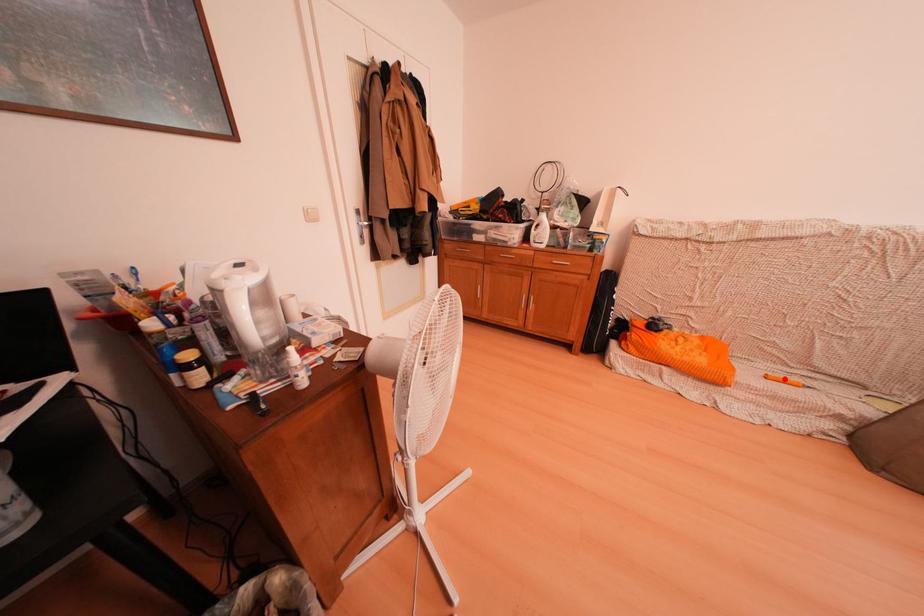
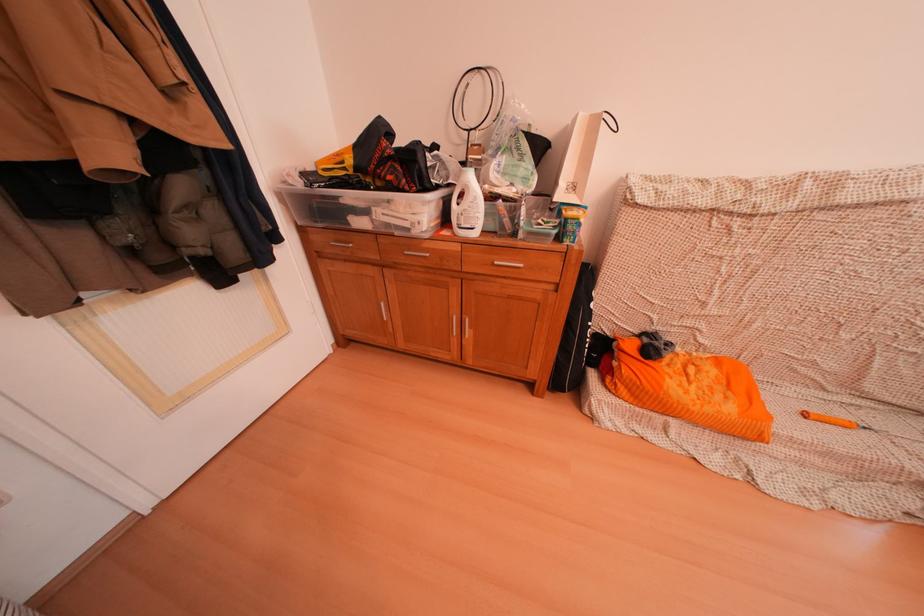
Find the pixel in the second image that matches the highlighted location in the first image.

(824, 415)